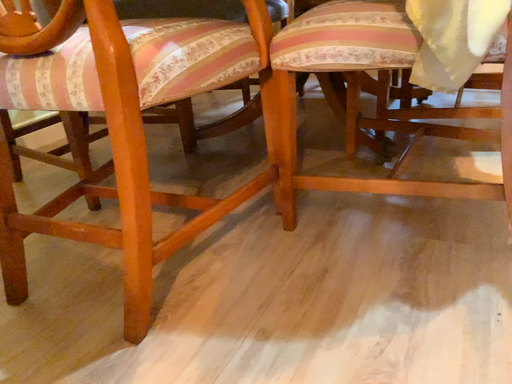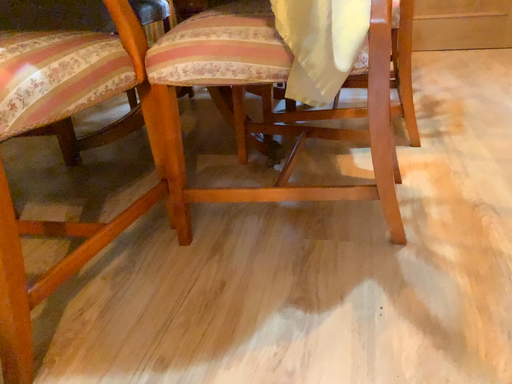
Question: Which way did the camera rotate in the video?

Choices:
 (A) rotated right
 (B) rotated left

Answer: (A)